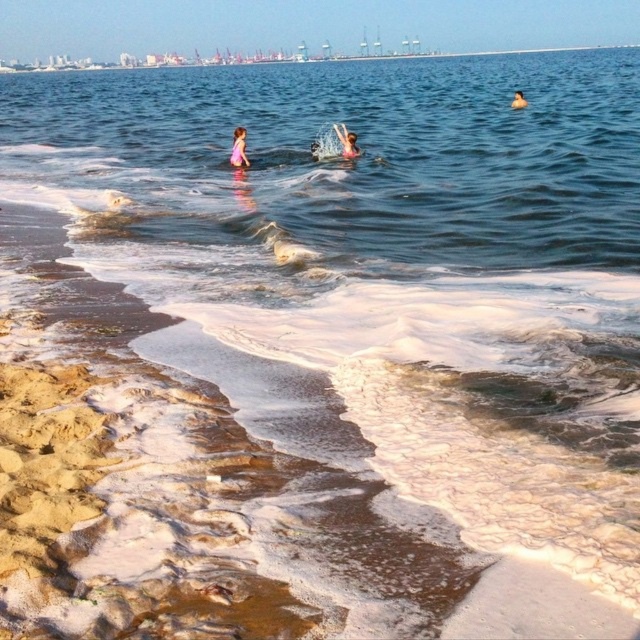
You are a photographer at the beach scene described. You need to capture a photo where the pink fabric at upper center and the smooth skin person at upper center are both visible. Based on their positions, which object will appear closer to the bottom of the photo?

The pink fabric at upper center is shorter than the smooth skin person at upper center, so it will appear closer to the bottom of the photo.

You are a photographer trying to capture a photo of the smooth skin person at upper center and the pink fabric at center. Which object should you focus on first if you want to ensure both are in focus?

The pink fabric at center is closer to the viewer than the smooth skin person at upper center. To ensure both are in focus, you should focus on the pink fabric at center first, as it is closer, allowing the depth of field to extend to the farther object.